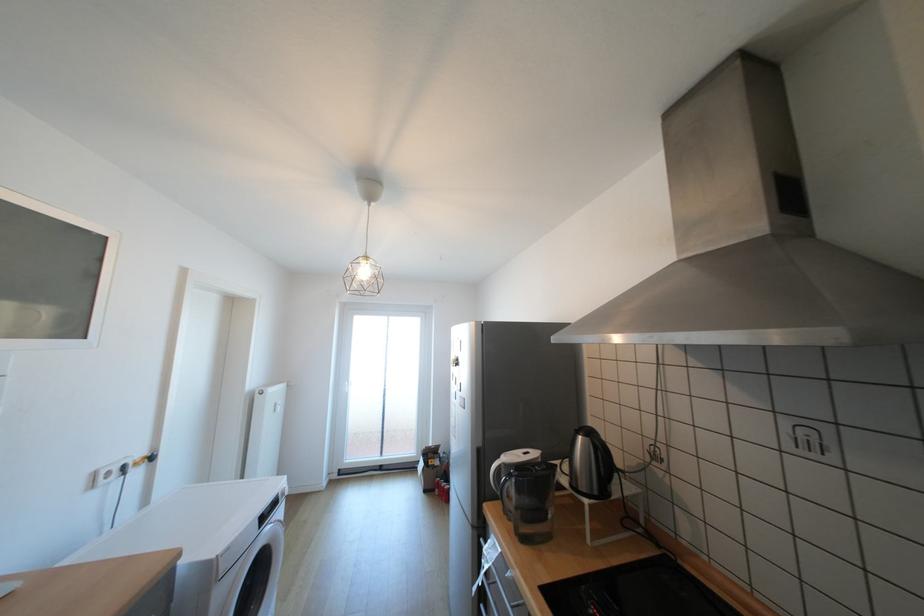
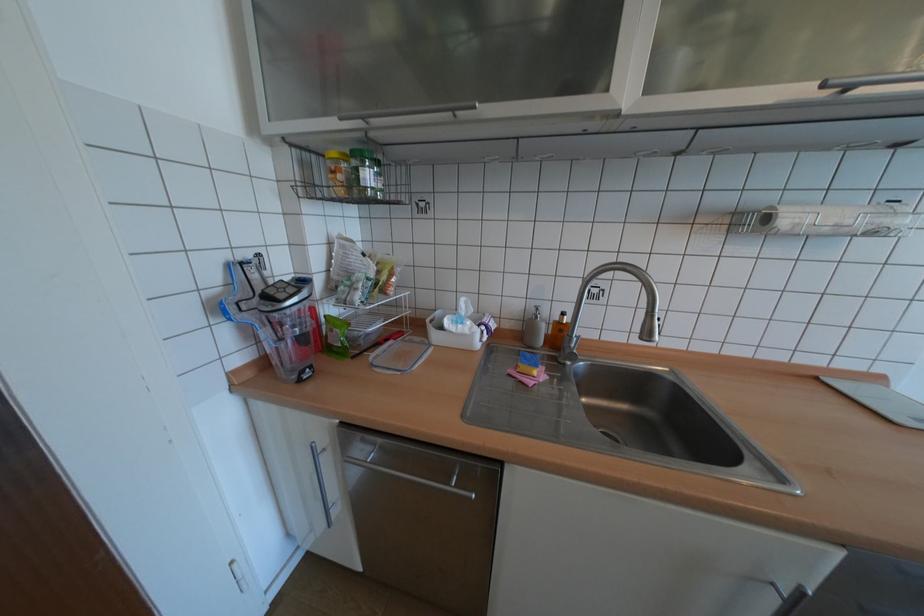
Question: The first image is from the beginning of the video and the second image is from the end. How did the camera likely rotate when shooting the video?

Choices:
 (A) Left
 (B) Right
 (C) Up
 (D) Down

Answer: (A)